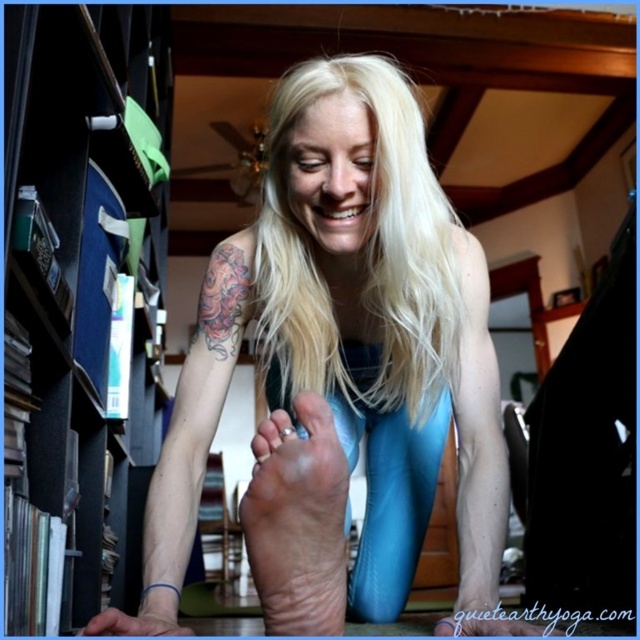
Is the position of colorful ink tattoo at upper left less distant than that of matte blue toe at lower center?

No, colorful ink tattoo at upper left is behind matte blue toe at lower center.

Measure the distance between point (220, 298) and camera.

Point (220, 298) is 3.58 feet away from camera.

Does point (228, 344) come in front of point (445, 624)?

No, (228, 344) is behind (445, 624).

The height and width of the screenshot is (640, 640). I want to click on colorful ink tattoo at upper left, so click(x=225, y=298).

Is blonde silky hair at center behind colorful ink tattoo at upper left?

That is False.

Is blonde silky hair at center thinner than colorful ink tattoo at upper left?

Incorrect, blonde silky hair at center's width is not less than colorful ink tattoo at upper left's.

I want to click on blonde silky hair at center, so click(364, 253).

Can you confirm if blue shiny leggings at center is shorter than colorful ink tattoo at upper left?

No, blue shiny leggings at center is not shorter than colorful ink tattoo at upper left.

Is blue shiny leggings at center behind colorful ink tattoo at upper left?

No, blue shiny leggings at center is in front of colorful ink tattoo at upper left.

This screenshot has width=640, height=640. Describe the element at coordinates (365, 356) in the screenshot. I see `blue shiny leggings at center` at that location.

What are the coordinates of `blue shiny leggings at center` in the screenshot? It's located at (365, 356).